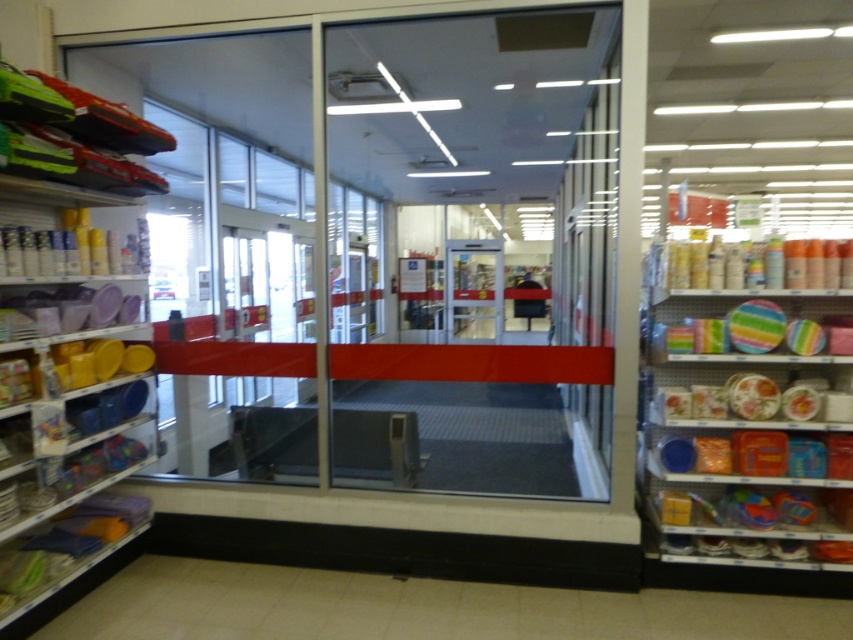
Consider the image. You are a customer in the store and want to pick up the matte plastic plates at right and the matte plastic containers at right. Which item should you reach for first if you want to grab the one that is nearer to you?

The matte plastic plates at right are closer to the viewer than the matte plastic containers at right, so you should reach for the matte plastic plates at right first.